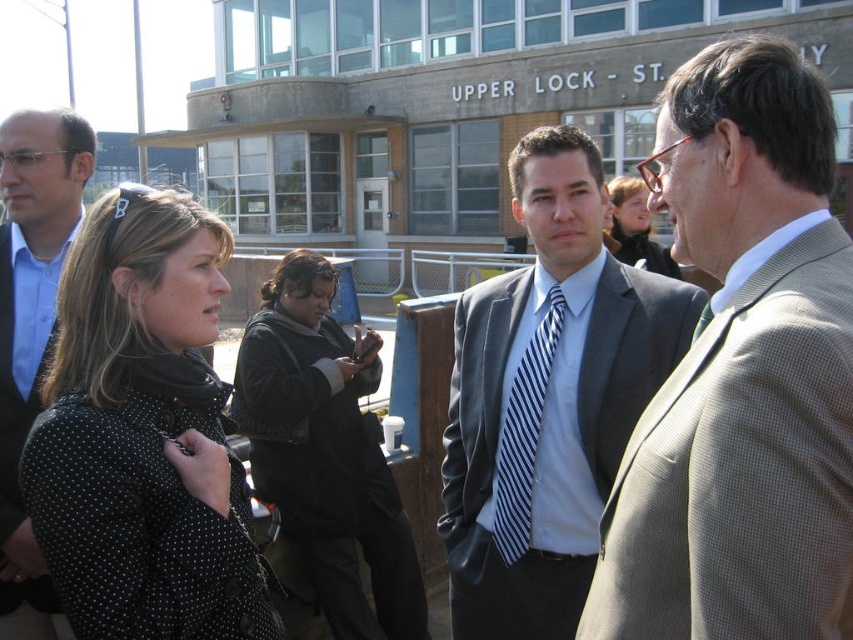
Question: In this image, where is dark gray suit at center located relative to black fabric jacket at center?

Choices:
 (A) above
 (B) below

Answer: (A)

Question: Which point is closer to the camera?

Choices:
 (A) matte black suit at left
 (B) black dotted coat at left

Answer: (B)

Question: Which of the following is the farthest from the observer?

Choices:
 (A) matte black jacket at center
 (B) matte black suit at left

Answer: (A)

Question: From the image, what is the correct spatial relationship of black fabric jacket at center in relation to matte black suit at left?

Choices:
 (A) right
 (B) left

Answer: (A)

Question: From the image, what is the correct spatial relationship of gray checkered suit at center in relation to matte black suit at left?

Choices:
 (A) left
 (B) right

Answer: (B)

Question: Which object is positioned closest to the dark gray suit at center?

Choices:
 (A) matte black suit at left
 (B) matte black jacket at center
 (C) gray checkered suit at center

Answer: (C)